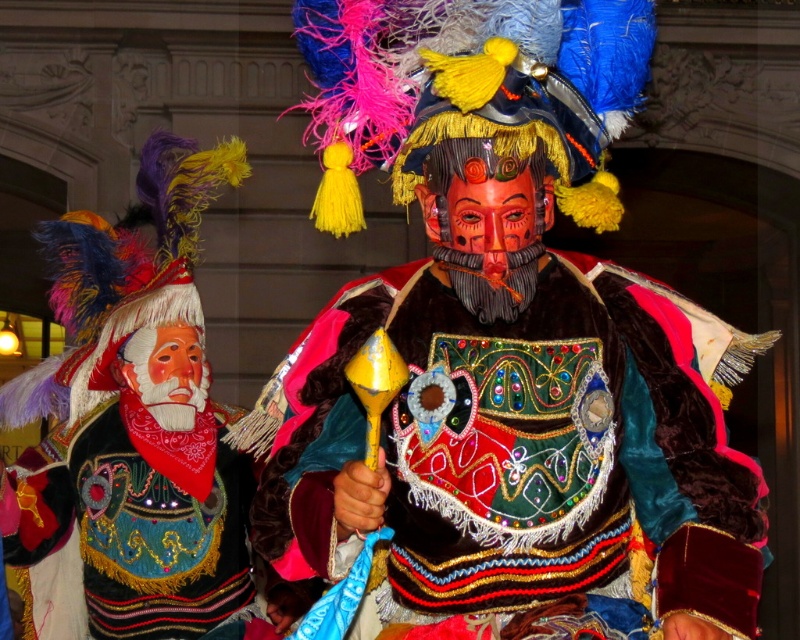
Who is higher up, velvet/cloth mask at center or matte black headdress at left?

Positioned higher is matte black headdress at left.

Is point (734, 337) positioned behind point (122, 589)?

No, (734, 337) is closer to viewer.

Is point (446, 134) in front of point (106, 538)?

Yes.

This screenshot has height=640, width=800. Identify the location of velvet/cloth mask at center. (516, 404).